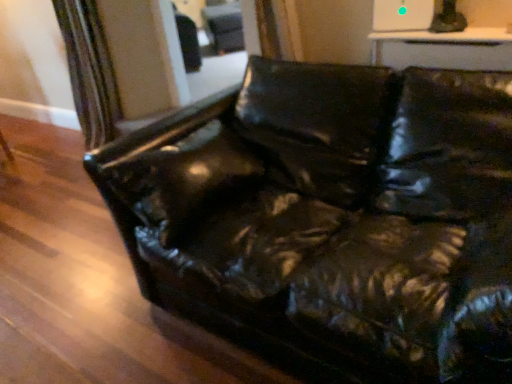
Question: Considering their positions, is black leather swivel chair at upper center located in front of or behind shiny black leather couch at center?

Choices:
 (A) front
 (B) behind

Answer: (B)

Question: Does point (224, 21) appear closer or farther from the camera than point (435, 114)?

Choices:
 (A) farther
 (B) closer

Answer: (A)

Question: From a real-world perspective, is black leather swivel chair at upper center physically located above or below shiny black leather couch at center?

Choices:
 (A) above
 (B) below

Answer: (A)

Question: Is shiny black leather couch at center to the left or to the right of black leather swivel chair at upper center in the image?

Choices:
 (A) left
 (B) right

Answer: (B)

Question: In the image, is shiny black leather couch at center positioned in front of or behind black leather swivel chair at upper center?

Choices:
 (A) front
 (B) behind

Answer: (A)

Question: Does point (467, 92) appear closer or farther from the camera than point (234, 16)?

Choices:
 (A) closer
 (B) farther

Answer: (A)

Question: Choose the correct answer: Is shiny black leather couch at center inside black leather swivel chair at upper center or outside it?

Choices:
 (A) outside
 (B) inside

Answer: (A)